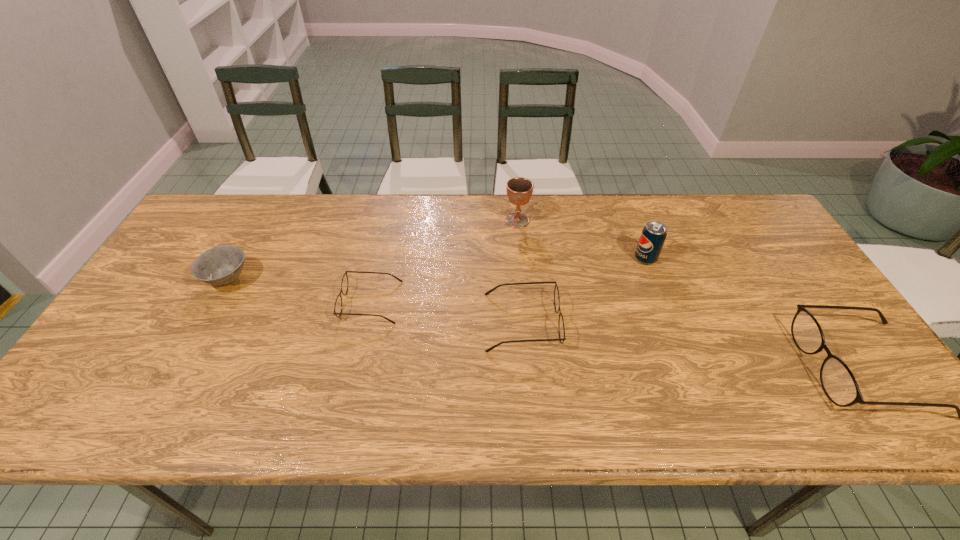
Where is `vacant space located on the front-facing side of the second tallest spectacles`? vacant space located on the front-facing side of the second tallest spectacles is located at coordinates (641, 322).

The height and width of the screenshot is (540, 960). I want to click on free space located on the back of the leftmost object, so [x=251, y=237].

I want to click on vacant position located on the back of the chalice, so click(x=516, y=200).

At what (x,y) coordinates should I click in order to perform the action: click on vacant space positioned on the back of the second object from right to left. Please return your answer as a coordinate pair (x, y). This screenshot has height=540, width=960. Looking at the image, I should click on (626, 206).

Find the location of a particular element. The image size is (960, 540). object located in the far edge section of the desktop is located at coordinates pos(519,190).

Locate an element on the screen. object present at the left edge is located at coordinates (221, 265).

The width and height of the screenshot is (960, 540). Find the location of `vacant space at the far edge of the desktop`. vacant space at the far edge of the desktop is located at coordinates (375, 240).

Identify the location of vacant area at the near edge of the desktop. This screenshot has height=540, width=960. (456, 369).

Identify the location of vacant space at the left edge of the desktop. (145, 346).

In the image, there is a desktop. Where is `free space at the right edge`? The image size is (960, 540). free space at the right edge is located at coordinates (754, 251).